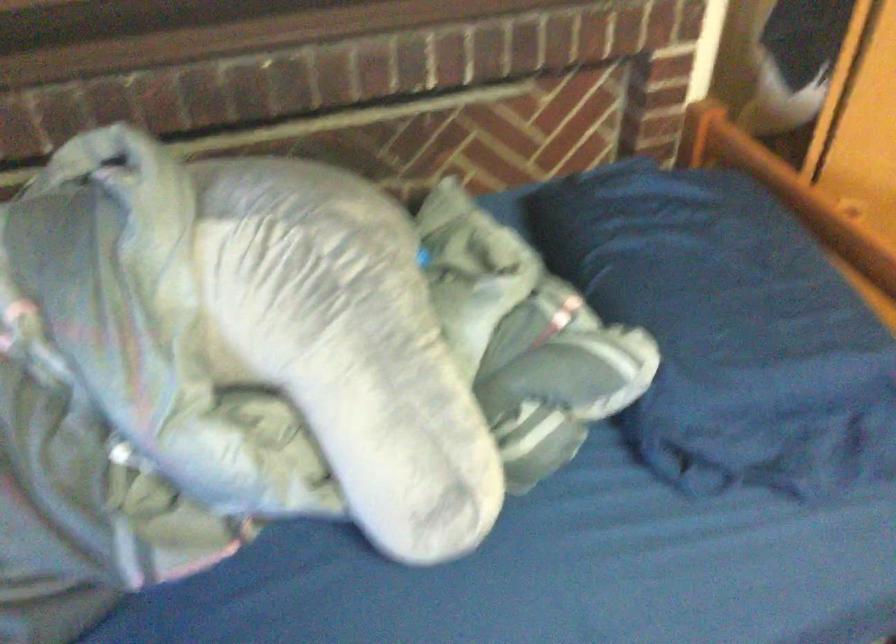
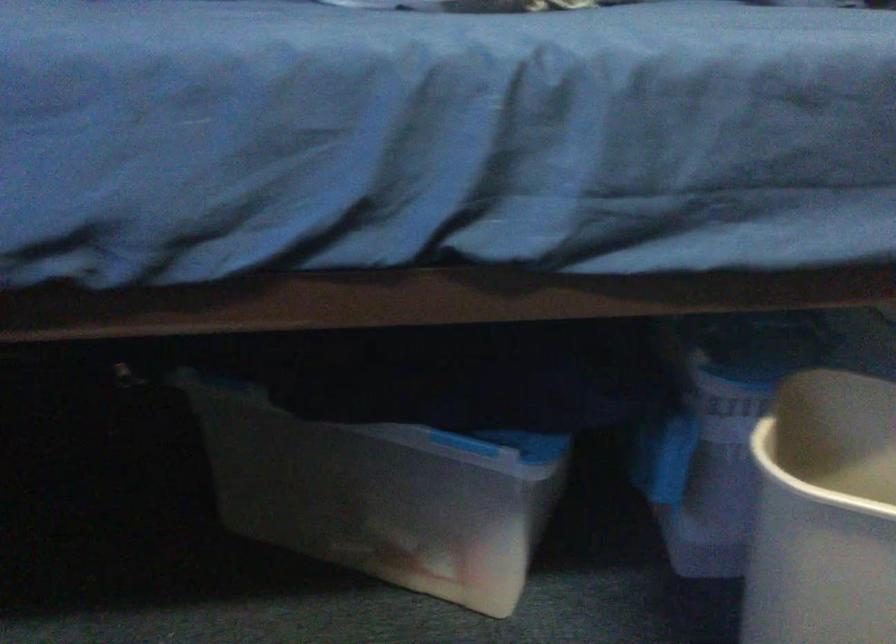
Consider the image. Which direction would the cameraman need to move to produce the second image?

The movement direction of the cameraman is right, forward.